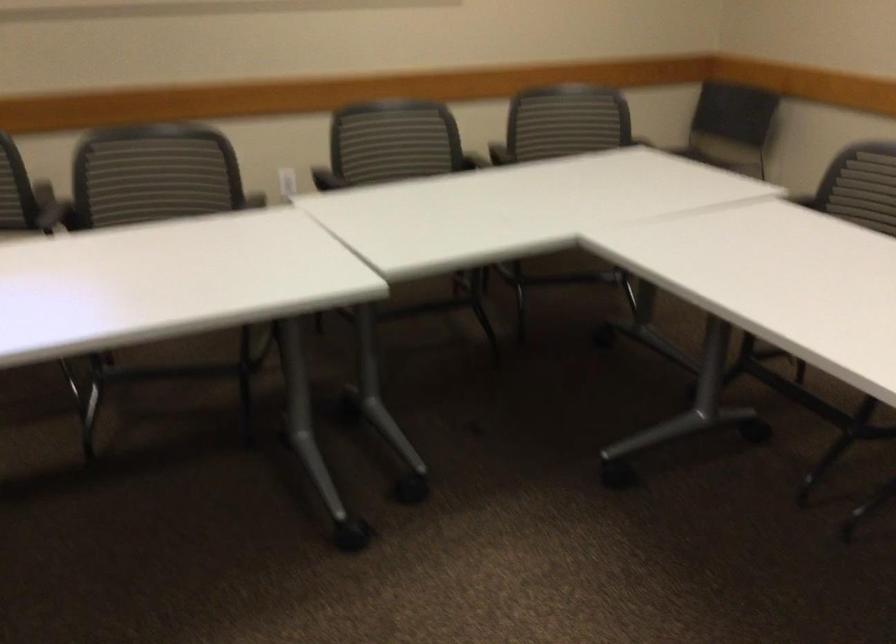
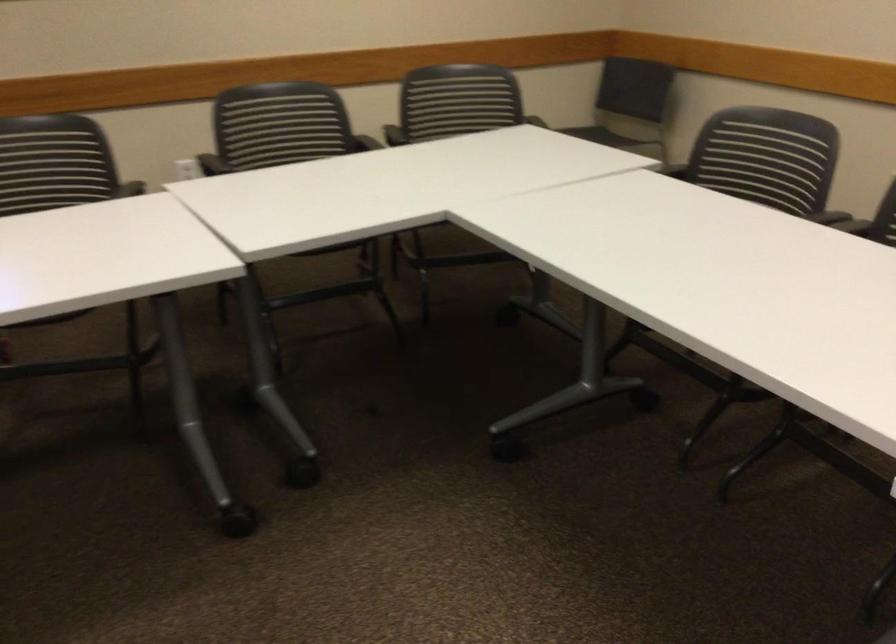
Question: What movement of the cameraman would produce the second image?

Choices:
 (A) Left
 (B) Right
 (C) Forward
 (D) Backward

Answer: (B)